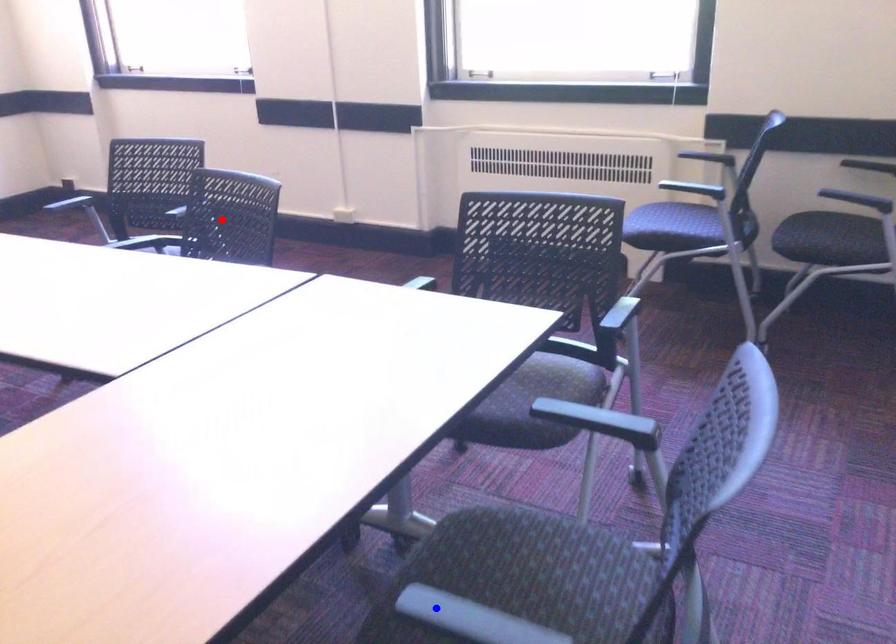
Question: In the image, two points are highlighted. Which point is nearer to the camera? Reply with the corresponding letter.

Choices:
 (A) blue point
 (B) red point

Answer: (A)